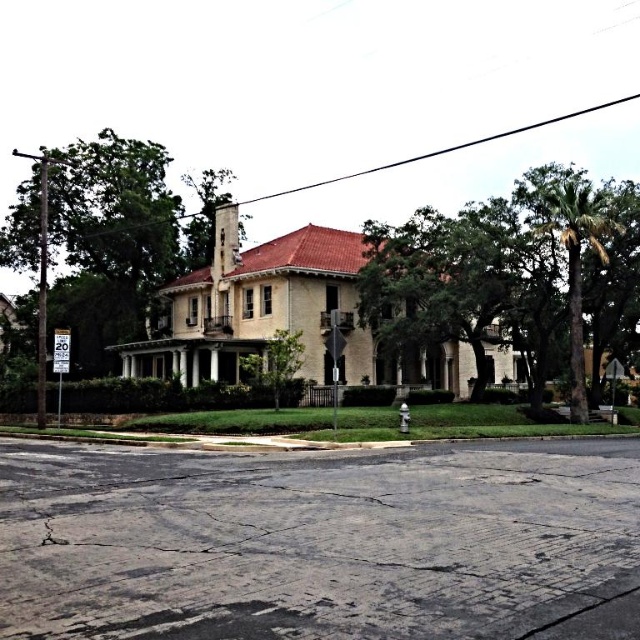
Question: Observing the image, what is the correct spatial positioning of green leafy tree at right in reference to green leafy tree at left?

Choices:
 (A) above
 (B) below

Answer: (B)

Question: Is green leafy tree at right thinner than white plastic speed limit sign at upper left?

Choices:
 (A) yes
 (B) no

Answer: (B)

Question: Which object is farther from the camera taking this photo?

Choices:
 (A) white plastic speed limit sign at left
 (B) green leafy tree at right

Answer: (A)

Question: Which object is farther from the camera taking this photo?

Choices:
 (A) green leafy tree at left
 (B) white plastic speed limit sign at upper left

Answer: (A)

Question: Is black asphalt at lower center positioned behind white plastic speed limit sign at left?

Choices:
 (A) yes
 (B) no

Answer: (B)

Question: Which point appears farthest from the camera in this image?

Choices:
 (A) (58, 404)
 (B) (61, 572)
 (C) (384, 227)

Answer: (C)